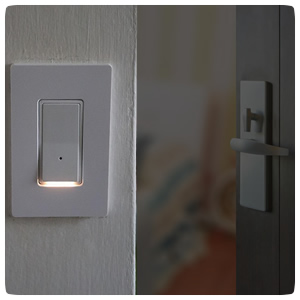
Find the location of a particular element. white paint is located at coordinates (109, 31).